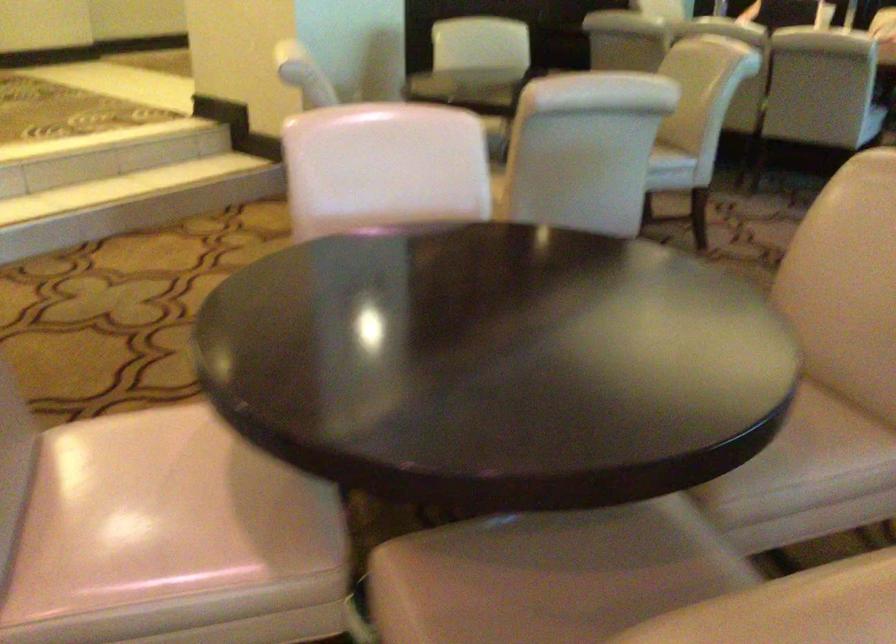
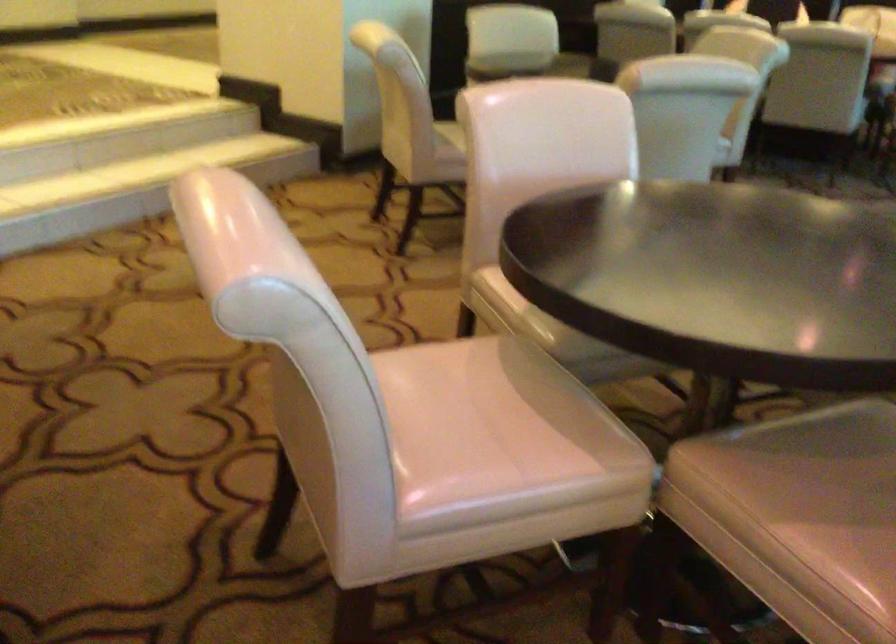
Question: In a continuous first-person perspective shot, in which direction is the camera moving?

Choices:
 (A) Left
 (B) Right
 (C) Forward
 (D) Backward

Answer: (A)